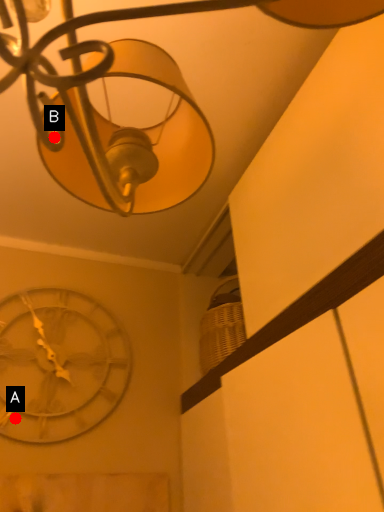
Question: Two points are circled on the image, labeled by A and B beside each circle. Which point is farther from the camera taking this photo?

Choices:
 (A) A is further
 (B) B is further

Answer: (A)